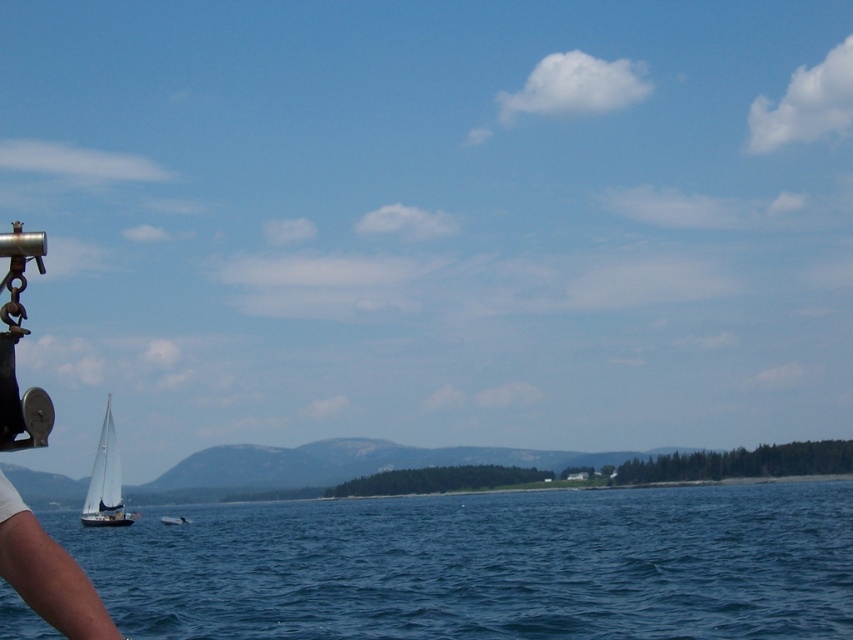
Is point (76, 604) behind point (102, 502)?

That is False.

Who is positioned more to the left, white fabric arm at lower left or white matte sailboat at left?

From the viewer's perspective, white matte sailboat at left appears more on the left side.

Does point (22, 538) lie behind point (97, 444)?

No, (22, 538) is closer to viewer.

Locate an element on the screen. white fabric arm at lower left is located at coordinates (47, 573).

Between point (102, 483) and point (166, 524), which one is positioned behind?

The point (166, 524) is behind.

Who is positioned more to the right, white matte sailboat at left or white glossy boat at center?

Positioned to the right is white glossy boat at center.

Does point (122, 518) lie in front of point (167, 516)?

Yes, it is in front of point (167, 516).

Image resolution: width=853 pixels, height=640 pixels. Find the location of `white matte sailboat at left`. white matte sailboat at left is located at coordinates (105, 481).

Who is lower down, white fabric arm at lower left or white glossy boat at center?

white glossy boat at center

Who is taller, white fabric arm at lower left or white glossy boat at center?

With more height is white glossy boat at center.

Locate an element on the screen. The width and height of the screenshot is (853, 640). white fabric arm at lower left is located at coordinates (47, 573).

You are a GUI agent. You are given a task and a screenshot of the screen. Output one action in this format:
    pyautogui.click(x=<x>, y=<y>)
    Task: Click on the white fabric arm at lower left
    The height and width of the screenshot is (640, 853).
    Given the screenshot: What is the action you would take?
    pyautogui.click(x=47, y=573)